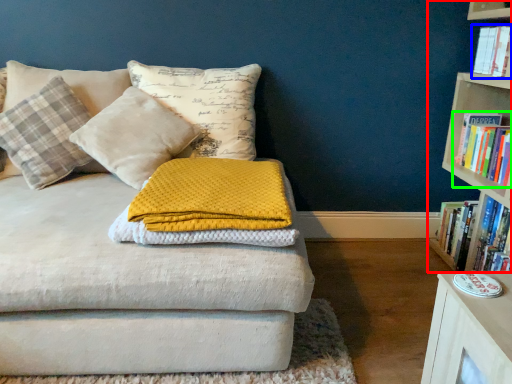
Question: Which object is positioned farthest from bookcase (highlighted by a red box)? Select from book (highlighted by a blue box) and book (highlighted by a green box).

Choices:
 (A) book
 (B) book

Answer: (A)